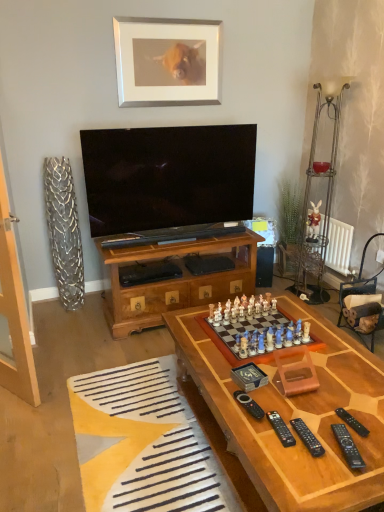
Where is `free location in front of black plastic remote at lower right, the third remote in the left-to-right sequence`? Image resolution: width=384 pixels, height=512 pixels. free location in front of black plastic remote at lower right, the third remote in the left-to-right sequence is located at coordinates (314, 476).